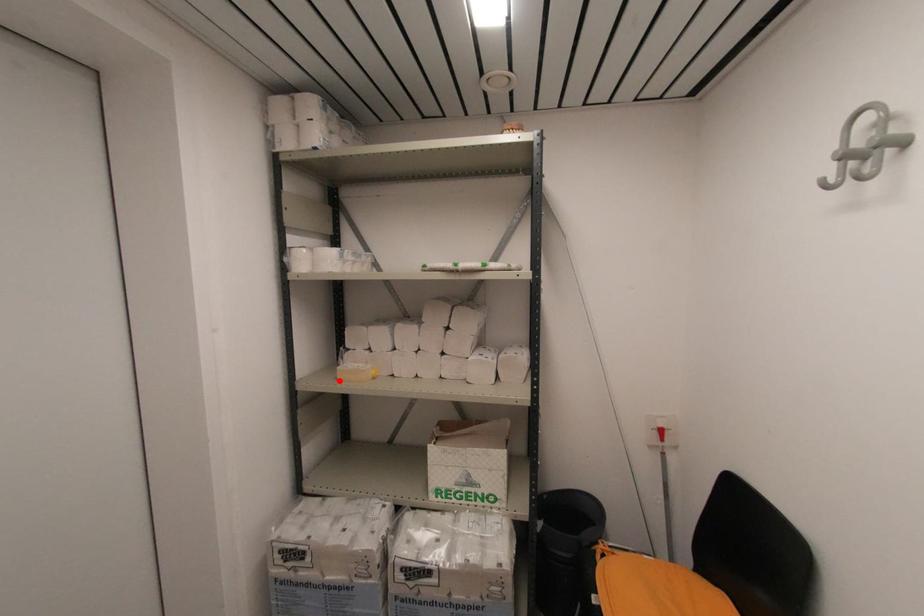
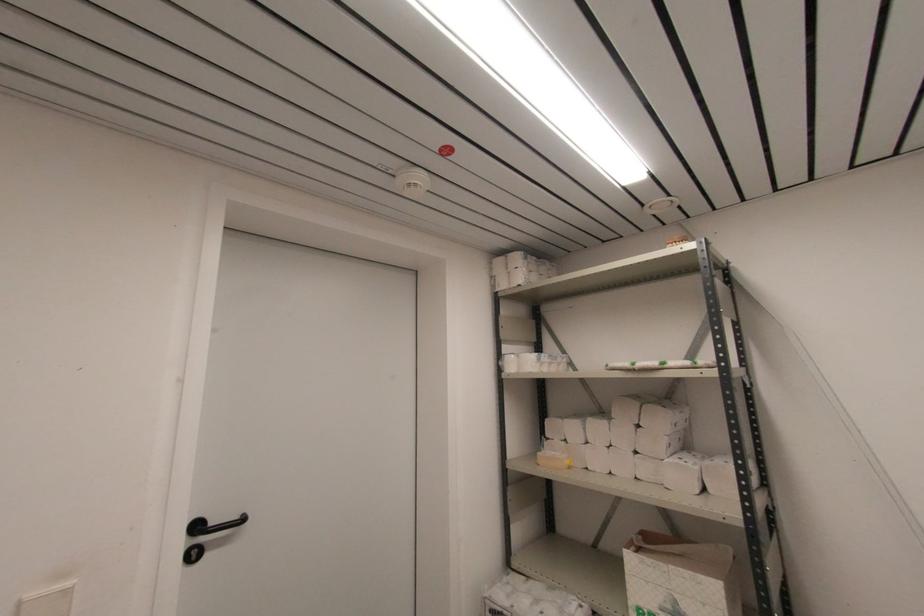
Locate, in the second image, the point that corresponds to the highlighted location in the first image.

(540, 464)